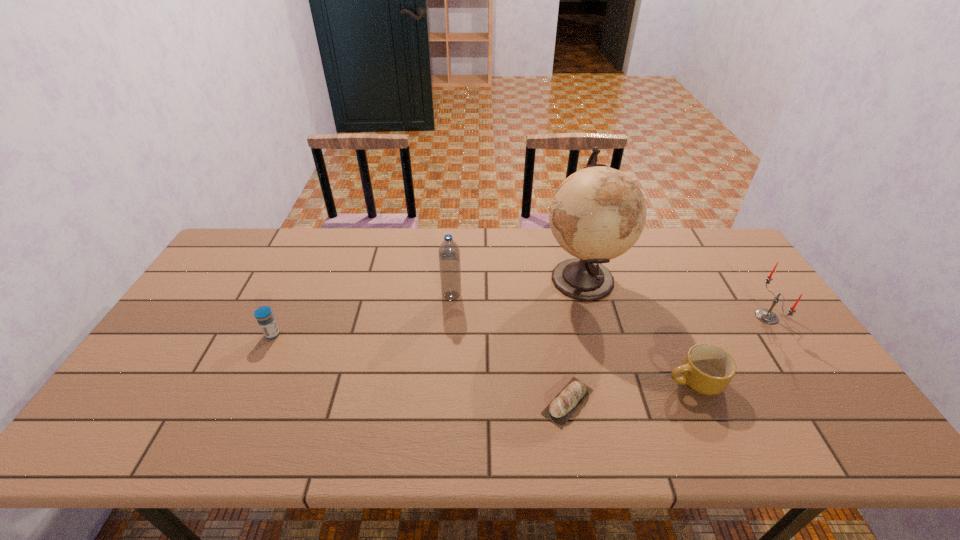
Where is `blank space that satisfies the following two spatial constraints: 1. on the front-facing side of the globe; 2. on the front side of the shortest object`? blank space that satisfies the following two spatial constraints: 1. on the front-facing side of the globe; 2. on the front side of the shortest object is located at coordinates click(x=615, y=402).

Find the location of a particular element. vacant space that satisfies the following two spatial constraints: 1. on the front side of the medicine; 2. on the left side of the pita bread is located at coordinates (241, 402).

The image size is (960, 540). What are the coordinates of `free space that satisfies the following two spatial constraints: 1. on the front-facing side of the globe; 2. on the side with the handle of the mug` in the screenshot? It's located at click(x=610, y=382).

Find the location of a particular element. The image size is (960, 540). free space that satisfies the following two spatial constraints: 1. on the side with the handle of the fifth object from left to right; 2. on the front-facing side of the globe is located at coordinates (649, 278).